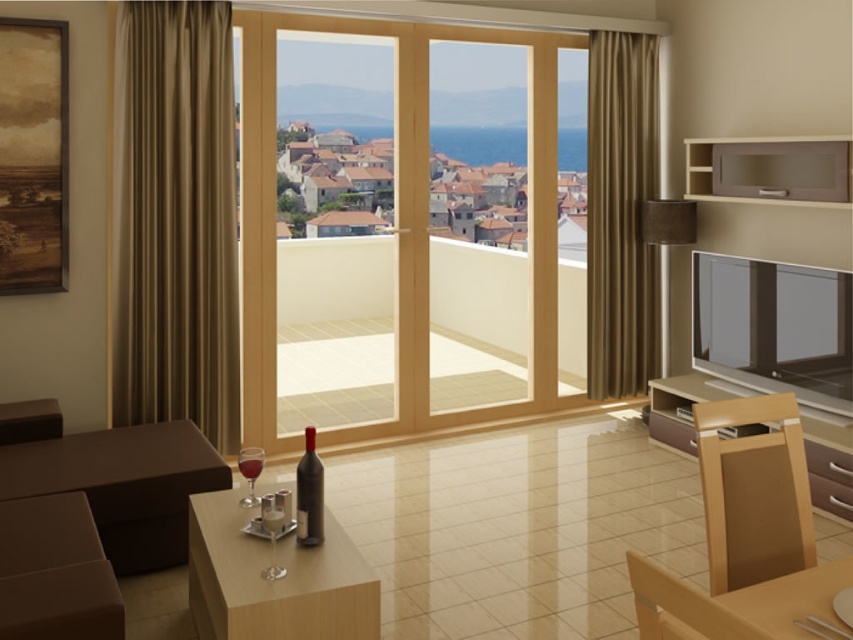
Looking at this image, you are standing at the entrance of the living room and want to move towards the two points marked in the image. Which point, point 1 at coordinates point (648, 637) or point 2 at coordinates point (753, 605), is closer to you as you enter?

Point 1 at coordinates point (648, 637) is closer to you as you enter because it is in front of point 2 at coordinates point (753, 605).

Looking at this image, you are a delivery person holding a package that is 1.5 meters long. You need to place it on the light brown wooden chair at lower right. Can the package fit on the chair?

The light brown wooden chair at lower right is 1.28 meters from camera, so the package is longer than the chair, so it cannot fit.